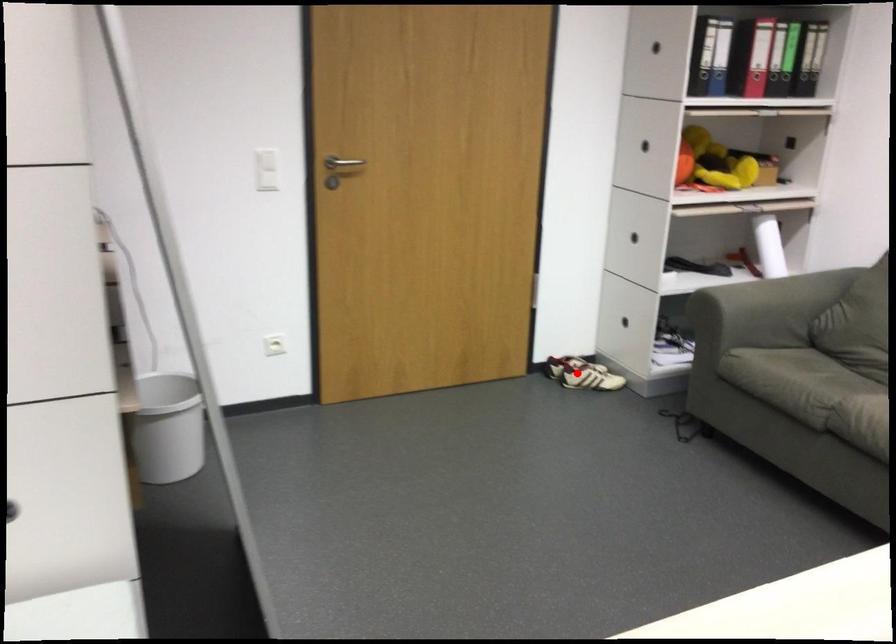
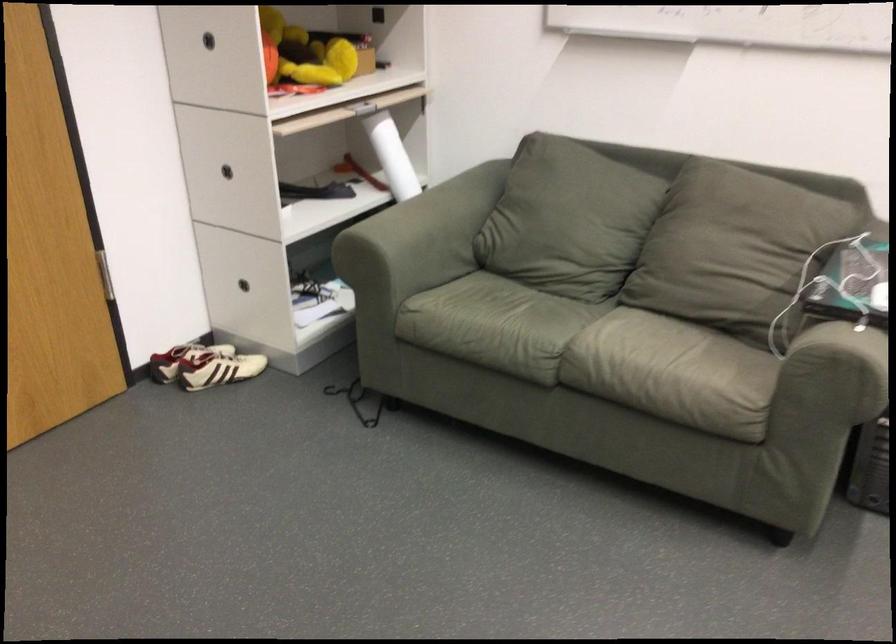
Question: I am providing you with two images of the same scene from different viewpoints. A red point is shown in image1. For the corresponding object point in image2, is it positioned nearer or farther from the camera?

Choices:
 (A) Nearer
 (B) Farther

Answer: (A)